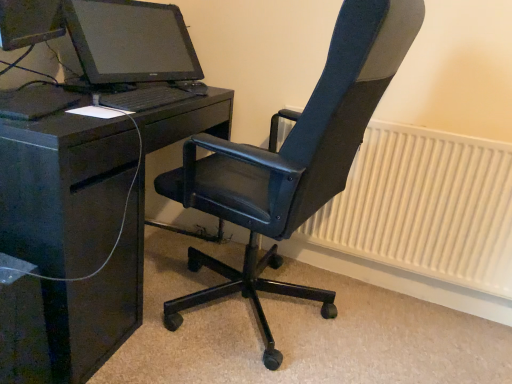
The height and width of the screenshot is (384, 512). I want to click on vacant area to the right of black leather office chair at center, so click(409, 338).